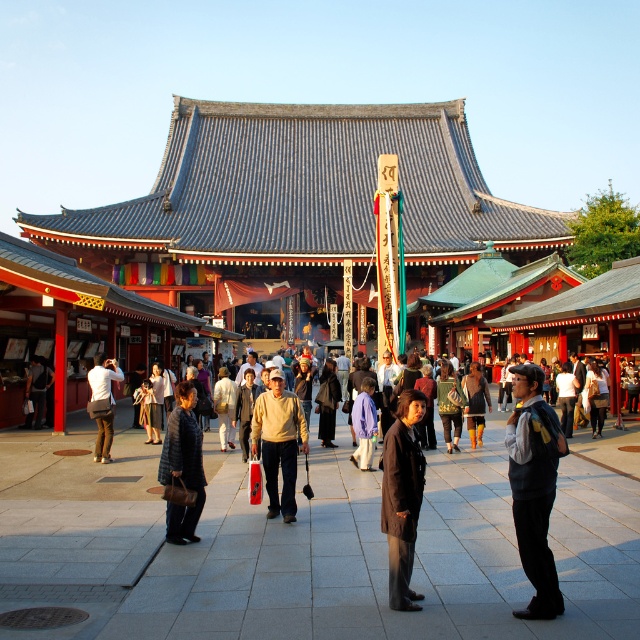
Question: Is matte black jacket at center thinner than brown leather jacket at center?

Choices:
 (A) yes
 (B) no

Answer: (B)

Question: Among these points, which one is nearest to the camera?

Choices:
 (A) (182, 420)
 (B) (472, 369)
 (C) (88, 380)
 (D) (404, 534)

Answer: (D)

Question: Is dark gray fabric coat at center bigger than matte black jacket at center?

Choices:
 (A) no
 (B) yes

Answer: (A)

Question: Which of the following is the closest to the observer?

Choices:
 (A) brown leather jacket at center
 (B) light brown sweater at center
 (C) dark blue textured coat at center
 (D) dark gray fabric coat at center

Answer: (D)

Question: Does light brown sweater at center have a smaller size compared to dark blue textured coat at center?

Choices:
 (A) no
 (B) yes

Answer: (A)

Question: Which object is farther from the camera taking this photo?

Choices:
 (A) brown leather jacket at center
 (B) matte black jacket at center

Answer: (A)